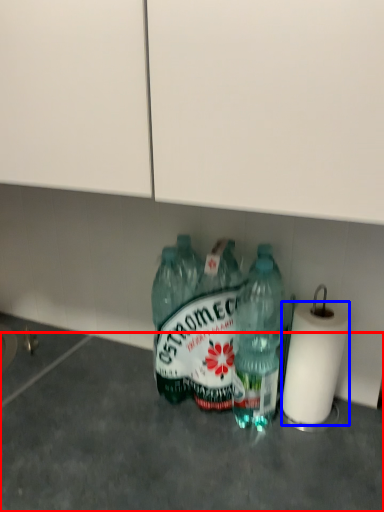
Question: Among these objects, which one is nearest to the camera, concrete (highlighted by a red box) or paper towel (highlighted by a blue box)?

Choices:
 (A) concrete
 (B) paper towel

Answer: (A)